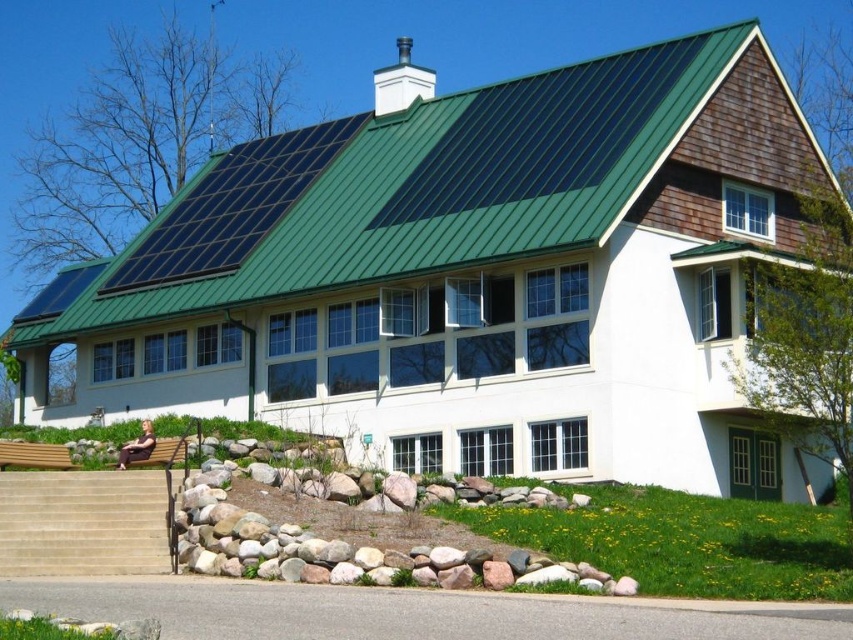
You are standing at the front of the house and want to go up the beige stone stairs at lower left. Which direction should you move relative to the green metal roof at center?

The beige stone stairs at lower left are to the left of the green metal roof at center, so you should move to the left relative to the green metal roof at center to reach them.